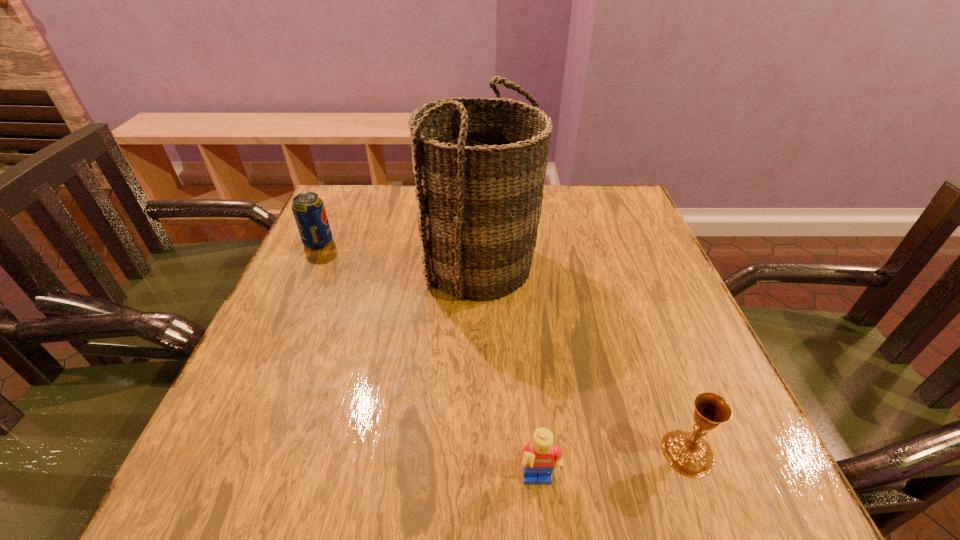
In order to click on vacant region between the rightmost object and the tallest object in this screenshot , I will do `click(584, 359)`.

Locate an element on the screen. Image resolution: width=960 pixels, height=540 pixels. unoccupied area between the rightmost object and the soda is located at coordinates click(x=503, y=348).

This screenshot has width=960, height=540. In order to click on free space between the tallest object and the chalice in this screenshot , I will do `click(584, 359)`.

This screenshot has width=960, height=540. What are the coordinates of `vacant space in between the leftmost object and the chalice` in the screenshot? It's located at (503, 348).

Find the location of a particular element. The image size is (960, 540). free space between the Lego and the rightmost object is located at coordinates (613, 468).

This screenshot has width=960, height=540. Identify the location of free space between the soda and the rightmost object. (503, 348).

The height and width of the screenshot is (540, 960). In order to click on vacant point located between the basket and the chalice in this screenshot , I will do `click(584, 359)`.

The width and height of the screenshot is (960, 540). Identify the location of empty space that is in between the tallest object and the Lego. (509, 374).

Identify the location of free spot between the soda and the tallest object. (398, 254).

Identify which object is located as the third nearest to the soda. Please provide its 2D coordinates. Your answer should be formatted as a tuple, i.e. [(x, y)], where the tuple contains the x and y coordinates of a point satisfying the conditions above.

[(688, 453)]